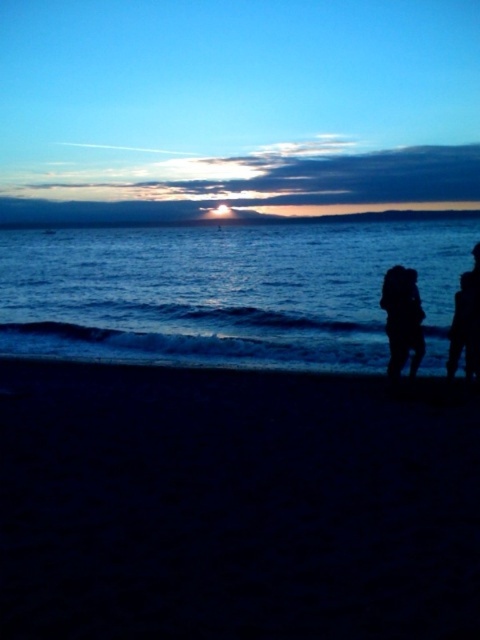
Question: Estimate the real-world distances between objects in this image. Which object is closer to the silhouette couple at right?

Choices:
 (A) blue water at center
 (B) silhouette figure at right
 (C) dark sand at lower center

Answer: (B)

Question: Which point is farther to the camera?

Choices:
 (A) [x=25, y=227]
 (B) [x=465, y=324]
 (C) [x=335, y=349]

Answer: (A)

Question: Can you confirm if black matte figure at lower right is thinner than silhouette figure at right?

Choices:
 (A) no
 (B) yes

Answer: (B)

Question: Can you confirm if blue water at center is positioned above silhouette couple at right?

Choices:
 (A) no
 (B) yes

Answer: (B)

Question: Considering the real-world distances, which object is closest to the dark sand at lower center?

Choices:
 (A) blue matte horizon at upper center
 (B) black matte figure at lower right
 (C) blue water at center

Answer: (B)

Question: Is silhouette couple at right in front of silhouette figure at right?

Choices:
 (A) yes
 (B) no

Answer: (A)